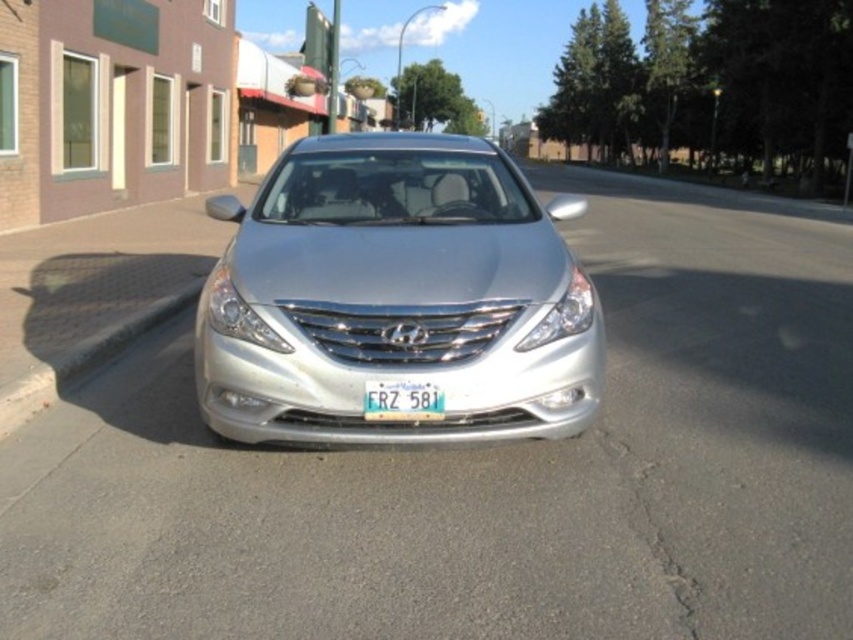
You are a delivery driver who needs to park your truck, which is 2 meters wide, in a spot next to the silver metallic sedan at center. The parking area has a black asphalt curb at lower left that you must not cross. Can your truck fit without crossing the curb?

The silver metallic sedan at center might be wider than black asphalt curb at lower left, so it is uncertain if the truck can fit without crossing the curb. Check the exact width measurements before proceeding.

You are a photographer trying to capture the silver Hyundai Sonata from a specific angle. You notice two points on the car, one at point (231, 300) and another at point (22, 416). Which point is closer to your camera lens?

Point (231, 300) is closer to the camera than point (22, 416).

You are a delivery driver who needs to park your vehicle close to the black asphalt curb at lower left without blocking the white plastic license plate at center. Is the size difference between the two objects a concern for parking?

The black asphalt curb at lower left is larger than the white plastic license plate at center, so the size difference is not a concern for parking as the curb provides sufficient space for proper parking alignment.